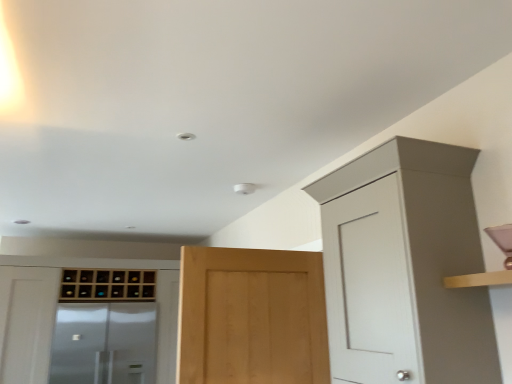
Find the location of a particular element. The width and height of the screenshot is (512, 384). transparent glass screen door at lower left is located at coordinates (104, 343).

The image size is (512, 384). Describe the element at coordinates (104, 343) in the screenshot. I see `transparent glass screen door at lower left` at that location.

What is the approximate height of wooden wine rack at center, which appears as the second cabinetry when viewed from the right?

The height of wooden wine rack at center, which appears as the second cabinetry when viewed from the right, is 12.29 inches.

Locate an element on the screen. The width and height of the screenshot is (512, 384). light brown wood door at center is located at coordinates (252, 316).

From a real-world perspective, between wooden wine rack at center, which is the 1th cabinetry in back-to-front order, and light brown wood door at center, who is vertically lower?

In real-world perspective, light brown wood door at center is lower.

Consider the image. Does wooden wine rack at center, positioned as the 3th cabinetry in front-to-back order, have a greater width compared to light brown wood door at center?

Indeed, wooden wine rack at center, positioned as the 3th cabinetry in front-to-back order, has a greater width compared to light brown wood door at center.

Is wooden wine rack at center, which is the 1th cabinetry in back-to-front order, in contact with light brown wood door at center?

They are not placed beside each other.

How much distance is there between wooden wine rack at center, which is the 1th cabinetry in back-to-front order, and light brown wood door at center?

wooden wine rack at center, which is the 1th cabinetry in back-to-front order, is 2.45 meters away from light brown wood door at center.

Which object is thinner, matte white cabinet at upper right, the third cabinetry from the back, or light brown wood door at center?

light brown wood door at center.

Considering the positions of objects matte white cabinet at upper right, which appears as the 1th cabinetry when viewed from the right, and light brown wood door at center in the image provided, who is in front, matte white cabinet at upper right, which appears as the 1th cabinetry when viewed from the right, or light brown wood door at center?

matte white cabinet at upper right, which appears as the 1th cabinetry when viewed from the right.

From the image's perspective, is matte white cabinet at upper right, the third cabinetry from the back, beneath light brown wood door at center?

Incorrect, from the image's perspective, matte white cabinet at upper right, the third cabinetry from the back, is higher than light brown wood door at center.

Is point (355, 178) closer to viewer compared to point (289, 325)?

That is True.

Can you confirm if wooden wine rack at center, which appears as the second cabinetry when viewed from the right, is wider than transparent glass screen door at lower left?

No.

Is wooden wine rack at center, the second cabinetry when ordered from left to right, spatially inside transparent glass screen door at lower left, or outside of it?

wooden wine rack at center, the second cabinetry when ordered from left to right, cannot be found inside transparent glass screen door at lower left.

Is wooden wine rack at center, which appears as the second cabinetry when viewed from the right, turned away from transparent glass screen door at lower left?

That's not correct — wooden wine rack at center, which appears as the second cabinetry when viewed from the right, is not looking away from transparent glass screen door at lower left.

Is point (111, 284) closer or farther from the camera than point (144, 308)?

Point (111, 284) appears to be closer to the viewer than point (144, 308).

Is wooden wine rack at center, positioned as the 3th cabinetry in front-to-back order, directly adjacent to matte white cabinet at upper right, the first cabinetry viewed from the front?

There is a gap between wooden wine rack at center, positioned as the 3th cabinetry in front-to-back order, and matte white cabinet at upper right, the first cabinetry viewed from the front.

Which of these two, wooden wine rack at center, positioned as the 3th cabinetry in front-to-back order, or matte white cabinet at upper right, which appears as the 1th cabinetry when viewed from the right, stands taller?

Standing taller between the two is matte white cabinet at upper right, which appears as the 1th cabinetry when viewed from the right.

Is wooden wine rack at center, which appears as the second cabinetry when viewed from the right, oriented away from matte white cabinet at upper right, which appears as the 1th cabinetry when viewed from the right?

No, matte white cabinet at upper right, which appears as the 1th cabinetry when viewed from the right, is not at the back of wooden wine rack at center, which appears as the second cabinetry when viewed from the right.

From a real-world perspective, is wooden wine rack at center, the second cabinetry when ordered from left to right, positioned above or below matte white cabinet at upper right, the third cabinetry from the back?

In terms of real-world spatial position, wooden wine rack at center, the second cabinetry when ordered from left to right, is above matte white cabinet at upper right, the third cabinetry from the back.

Based on their positions, is transparent glass screen door at lower left located to the left or right of wooden wine rack at left, acting as the 1th cabinetry starting from the left?

transparent glass screen door at lower left is to the right of wooden wine rack at left, acting as the 1th cabinetry starting from the left.

From the image's perspective, does transparent glass screen door at lower left appear lower than wooden wine rack at left, acting as the 2th cabinetry starting from the back?

Yes, from the image's perspective, transparent glass screen door at lower left is beneath wooden wine rack at left, acting as the 2th cabinetry starting from the back.

Are transparent glass screen door at lower left and wooden wine rack at left, positioned as the third cabinetry in right-to-left order, beside each other?

No.

In the image, is transparent glass screen door at lower left positioned in front of or behind wooden wine rack at left, marked as the second cabinetry in a front-to-back arrangement?

In the image, transparent glass screen door at lower left appears behind wooden wine rack at left, marked as the second cabinetry in a front-to-back arrangement.

Can you confirm if transparent glass screen door at lower left is thinner than light brown wood door at center?

No.

I want to click on screen door lying on the left of light brown wood door at center, so click(x=104, y=343).

From a real-world perspective, who is located higher, wooden wine rack at left, positioned as the third cabinetry in right-to-left order, or matte white cabinet at upper right, placed as the third cabinetry when sorted from left to right?

matte white cabinet at upper right, placed as the third cabinetry when sorted from left to right, from a real-world perspective.

Between wooden wine rack at left, acting as the 1th cabinetry starting from the left, and matte white cabinet at upper right, the first cabinetry viewed from the front, which one is positioned in front?

matte white cabinet at upper right, the first cabinetry viewed from the front, is more forward.

Is wooden wine rack at left, marked as the second cabinetry in a front-to-back arrangement, aimed at matte white cabinet at upper right, which appears as the 1th cabinetry when viewed from the right?

Yes.

From the image's perspective, is wooden wine rack at left, marked as the second cabinetry in a front-to-back arrangement, beneath matte white cabinet at upper right, placed as the third cabinetry when sorted from left to right?

Yes.

I want to click on the 2nd cabinetry behind the light brown wood door at center, so click(106, 285).

The height and width of the screenshot is (384, 512). I want to click on door on the left of the matte white cabinet at upper right, which appears as the 1th cabinetry when viewed from the right, so click(252, 316).

When comparing their distances from matte white cabinet at upper right, placed as the third cabinetry when sorted from left to right, does wooden wine rack at left, positioned as the third cabinetry in right-to-left order, or wooden wine rack at center, which appears as the second cabinetry when viewed from the right, seem closer?

wooden wine rack at center, which appears as the second cabinetry when viewed from the right, lies closer to matte white cabinet at upper right, placed as the third cabinetry when sorted from left to right, than the other object.

From the image, which object appears to be farther from transparent glass screen door at lower left, light brown wood door at center or matte white cabinet at upper right, the third cabinetry from the back?

matte white cabinet at upper right, the third cabinetry from the back, is positioned further to the anchor transparent glass screen door at lower left.

Considering their positions, is light brown wood door at center positioned closer to transparent glass screen door at lower left than wooden wine rack at center, which appears as the second cabinetry when viewed from the right?

wooden wine rack at center, which appears as the second cabinetry when viewed from the right.

Based on their spatial positions, is transparent glass screen door at lower left or matte white cabinet at upper right, which appears as the 1th cabinetry when viewed from the right, closer to wooden wine rack at left, acting as the 2th cabinetry starting from the back?

Based on the image, transparent glass screen door at lower left appears to be nearer to wooden wine rack at left, acting as the 2th cabinetry starting from the back.

Based on their spatial positions, is light brown wood door at center or transparent glass screen door at lower left further from wooden wine rack at left, marked as the second cabinetry in a front-to-back arrangement?

→ Based on the image, light brown wood door at center appears to be further to wooden wine rack at left, marked as the second cabinetry in a front-to-back arrangement.

When comparing their distances from matte white cabinet at upper right, placed as the third cabinetry when sorted from left to right, does light brown wood door at center or transparent glass screen door at lower left seem closer?

The object closer to matte white cabinet at upper right, placed as the third cabinetry when sorted from left to right, is light brown wood door at center.

From the picture: Which object lies nearer to the anchor point transparent glass screen door at lower left, wooden wine rack at center, which appears as the second cabinetry when viewed from the right, or light brown wood door at center?

wooden wine rack at center, which appears as the second cabinetry when viewed from the right, is closer to transparent glass screen door at lower left.

Estimate the real-world distances between objects in this image. Which object is closer to transparent glass screen door at lower left, matte white cabinet at upper right, placed as the third cabinetry when sorted from left to right, or wooden wine rack at center, the second cabinetry when ordered from left to right?

wooden wine rack at center, the second cabinetry when ordered from left to right, lies closer to transparent glass screen door at lower left than the other object.

Image resolution: width=512 pixels, height=384 pixels. Find the location of `screen door between light brown wood door at center and wooden wine rack at center, positioned as the 3th cabinetry in front-to-back order, from front to back`. screen door between light brown wood door at center and wooden wine rack at center, positioned as the 3th cabinetry in front-to-back order, from front to back is located at coordinates (104, 343).

At what (x,y) coordinates should I click in order to perform the action: click on cabinetry that lies between wooden wine rack at center, the second cabinetry when ordered from left to right, and transparent glass screen door at lower left from top to bottom. Please return your answer as a coordinate pair (x, y). Looking at the image, I should click on (27, 320).

Find the location of `cabinetry between light brown wood door at center and wooden wine rack at center, which appears as the second cabinetry when viewed from the right, along the z-axis`. cabinetry between light brown wood door at center and wooden wine rack at center, which appears as the second cabinetry when viewed from the right, along the z-axis is located at coordinates (27, 320).

This screenshot has width=512, height=384. In order to click on door between matte white cabinet at upper right, which appears as the 1th cabinetry when viewed from the right, and transparent glass screen door at lower left, along the z-axis in this screenshot , I will do `click(252, 316)`.